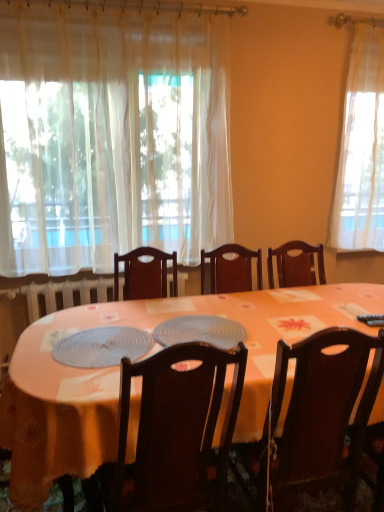
Question: Is dark wood chair at center, positioned as the second chair in left-to-right order, facing away from white sheer curtain at upper left?

Choices:
 (A) yes
 (B) no

Answer: (B)

Question: From a real-world perspective, is dark wood chair at center, positioned as the second chair in left-to-right order, below white sheer curtain at upper left?

Choices:
 (A) no
 (B) yes

Answer: (B)

Question: Is dark wood chair at center, positioned as the second chair in left-to-right order, closer to the viewer compared to white sheer curtain at upper left?

Choices:
 (A) no
 (B) yes

Answer: (B)

Question: Can you confirm if dark wood chair at center, which ranks as the 1th chair in right-to-left order, is wider than white sheer curtain at upper left?

Choices:
 (A) no
 (B) yes

Answer: (B)

Question: From the image's perspective, is dark wood chair at center, positioned as the second chair in left-to-right order, on white sheer curtain at upper left?

Choices:
 (A) yes
 (B) no

Answer: (B)

Question: Is translucent plastic platter at center, positioned as the 1th platter in left-to-right order, wider or thinner than dark wood chair at center, arranged as the 2th chair when viewed from the right?

Choices:
 (A) wide
 (B) thin

Answer: (B)

Question: Is translucent plastic platter at center, positioned as the 1th platter in left-to-right order, inside the boundaries of dark wood chair at center, arranged as the 2th chair when viewed from the right, or outside?

Choices:
 (A) outside
 (B) inside

Answer: (A)

Question: Considering the positions of translucent plastic platter at center, which is the second platter from right to left, and dark wood chair at center, arranged as the 2th chair when viewed from the right, in the image, is translucent plastic platter at center, which is the second platter from right to left, bigger or smaller than dark wood chair at center, arranged as the 2th chair when viewed from the right,?

Choices:
 (A) small
 (B) big

Answer: (A)

Question: Is translucent plastic platter at center, positioned as the 1th platter in left-to-right order, to the left or to the right of dark wood chair at center, arranged as the 2th chair when viewed from the right, in the image?

Choices:
 (A) left
 (B) right

Answer: (A)

Question: Is point (162, 334) positioned closer to the camera than point (357, 415)?

Choices:
 (A) closer
 (B) farther

Answer: (B)

Question: From the image's perspective, relative to dark wood chair at center, positioned as the second chair in left-to-right order, is translucent plastic placemat at center, marked as the first platter in a right-to-left arrangement, above or below?

Choices:
 (A) above
 (B) below

Answer: (A)

Question: In terms of height, does translucent plastic placemat at center, marked as the 2th platter in a left-to-right arrangement, look taller or shorter compared to dark wood chair at center, which ranks as the 1th chair in right-to-left order?

Choices:
 (A) short
 (B) tall

Answer: (A)

Question: Considering the positions of translucent plastic placemat at center, marked as the 2th platter in a left-to-right arrangement, and dark wood chair at center, positioned as the second chair in left-to-right order, in the image, is translucent plastic placemat at center, marked as the 2th platter in a left-to-right arrangement, bigger or smaller than dark wood chair at center, positioned as the second chair in left-to-right order,?

Choices:
 (A) big
 (B) small

Answer: (B)

Question: In terms of height, does dark wood chair at center, which is counted as the first chair, starting from the left, look taller or shorter compared to translucent plastic platter at center, positioned as the 1th platter in left-to-right order?

Choices:
 (A) short
 (B) tall

Answer: (B)

Question: From the image's perspective, is dark wood chair at center, arranged as the 2th chair when viewed from the right, located above or below translucent plastic platter at center, positioned as the 1th platter in left-to-right order?

Choices:
 (A) above
 (B) below

Answer: (B)